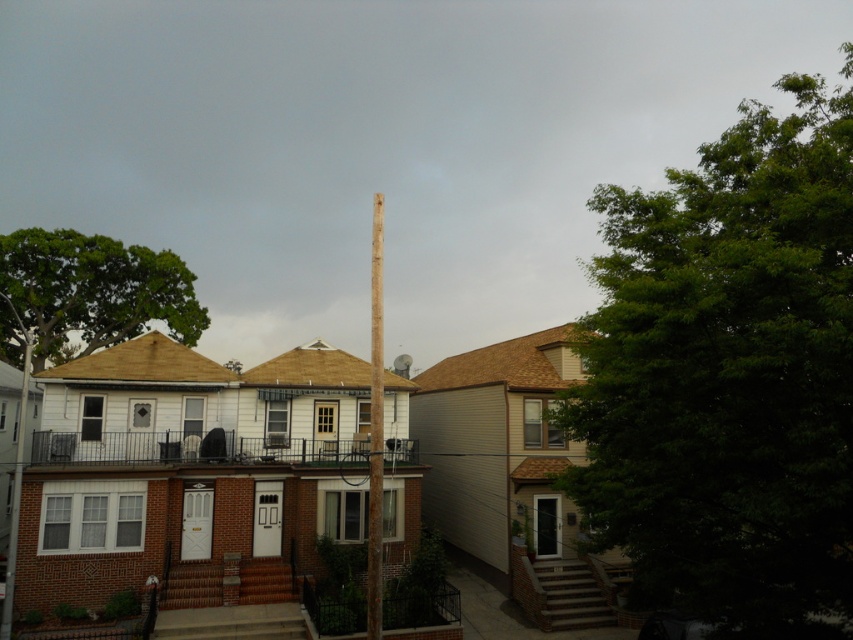
Question: Is smooth brown wooden pole at center smaller than brown wooden telegraph pole at left?

Choices:
 (A) yes
 (B) no

Answer: (B)

Question: Which of the following is the closest to the observer?

Choices:
 (A) (746, 173)
 (B) (370, 468)
 (C) (77, 257)
 (D) (13, 582)

Answer: (A)

Question: Which object appears farthest from the camera in this image?

Choices:
 (A) smooth brown wooden pole at center
 (B) green leafy tree at right
 (C) brown wooden telegraph pole at left

Answer: (C)

Question: Is green leafy tree at right bigger than smooth brown wooden pole at center?

Choices:
 (A) no
 (B) yes

Answer: (B)

Question: Which object is the closest to the green leafy tree at upper left?

Choices:
 (A) brown wooden telegraph pole at left
 (B) smooth brown wooden pole at center
 (C) green leafy tree at right

Answer: (A)

Question: Is green leafy tree at right thinner than smooth brown wooden pole at center?

Choices:
 (A) yes
 (B) no

Answer: (B)